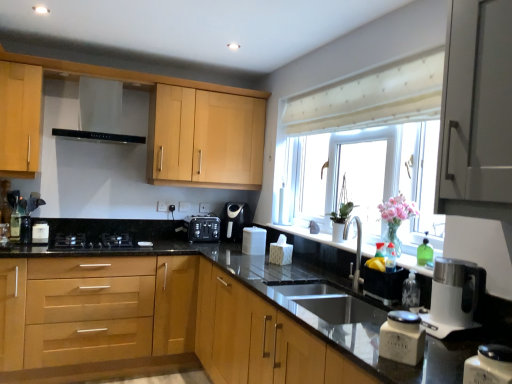
Question: Can you confirm if satin black coffee machine at center is thinner than clear plastic bottle at sink right, which ranks as the first bottle in right-to-left order?

Choices:
 (A) yes
 (B) no

Answer: (B)

Question: Is satin black coffee machine at center touching clear plastic bottle at sink right, which is the 2th bottle from back to front?

Choices:
 (A) yes
 (B) no

Answer: (B)

Question: Can you confirm if satin black coffee machine at center is taller than clear plastic bottle at sink right, positioned as the 2th bottle in top-to-bottom order?

Choices:
 (A) yes
 (B) no

Answer: (A)

Question: Does satin black coffee machine at center lie in front of clear plastic bottle at sink right, which appears as the first bottle when ordered from the bottom?

Choices:
 (A) no
 (B) yes

Answer: (A)

Question: Is satin black coffee machine at center shorter than clear plastic bottle at sink right, which is the second bottle from left to right?

Choices:
 (A) no
 (B) yes

Answer: (A)

Question: In the image, is black matte gas stove at lower left positioned in front of or behind white glossy container at lower right, the second kitchen appliance viewed from the left?

Choices:
 (A) behind
 (B) front

Answer: (A)

Question: From the image's perspective, relative to white glossy container at lower right, marked as the 1th kitchen appliance in a front-to-back arrangement, is black matte gas stove at lower left above or below?

Choices:
 (A) above
 (B) below

Answer: (A)

Question: Is black matte gas stove at lower left spatially inside white glossy container at lower right, which is counted as the first kitchen appliance, starting from the right, or outside of it?

Choices:
 (A) inside
 (B) outside

Answer: (B)

Question: From their relative heights in the image, would you say black matte gas stove at lower left is taller or shorter than white glossy container at lower right, the second kitchen appliance in the back-to-front sequence?

Choices:
 (A) short
 (B) tall

Answer: (A)

Question: Looking at the image, does satin grey cabinet at upper right, placed as the 2th cabinetry when sorted from bottom to top, seem bigger or smaller compared to pink glass vase at window?

Choices:
 (A) small
 (B) big

Answer: (B)

Question: Considering the positions of satin grey cabinet at upper right, the second cabinetry from the top, and pink glass vase at window in the image, is satin grey cabinet at upper right, the second cabinetry from the top, wider or thinner than pink glass vase at window?

Choices:
 (A) thin
 (B) wide

Answer: (B)

Question: Based on their positions, is satin grey cabinet at upper right, the second cabinetry from the top, located to the left or right of pink glass vase at window?

Choices:
 (A) right
 (B) left

Answer: (A)

Question: In terms of height, does satin grey cabinet at upper right, the second cabinetry from the top, look taller or shorter compared to pink glass vase at window?

Choices:
 (A) tall
 (B) short

Answer: (A)

Question: Is satin black toaster at center, which ranks as the second appliance in right-to-left order, taller or shorter than light wood/finish cabinet at upper left, the 3th cabinetry positioned from the bottom?

Choices:
 (A) tall
 (B) short

Answer: (B)

Question: Is satin black toaster at center, the first appliance when ordered from left to right, inside or outside of light wood/finish cabinet at upper left, the 3th cabinetry positioned from the bottom?

Choices:
 (A) outside
 (B) inside

Answer: (A)